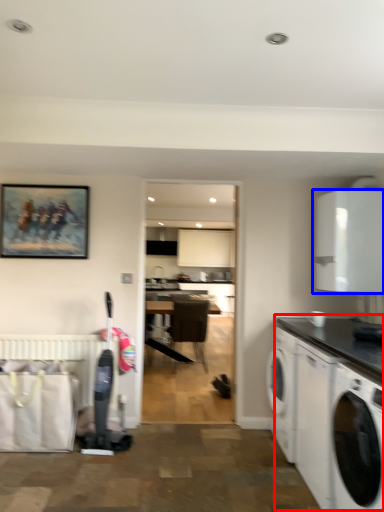
Question: Which of the following is the farthest to the observer, counter (highlighted by a red box) or cabinetry (highlighted by a blue box)?

Choices:
 (A) counter
 (B) cabinetry

Answer: (B)